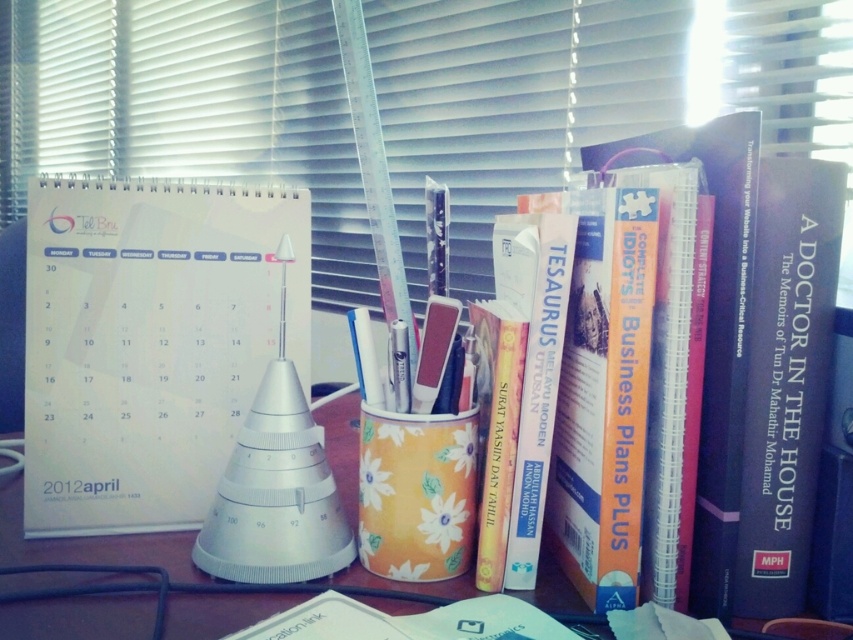
Does blue hardcover book at right appear over brown wooden table at center?

Yes, blue hardcover book at right is above brown wooden table at center.

Consider the image. Between blue hardcover book at right and brown wooden table at center, which one is positioned lower?

Positioned lower is brown wooden table at center.

You are a GUI agent. You are given a task and a screenshot of the screen. Output one action in this format:
    pyautogui.click(x=<x>, y=<y>)
    Task: Click on the blue hardcover book at right
    This screenshot has width=853, height=640.
    Given the screenshot: What is the action you would take?
    pyautogui.click(x=786, y=380)

Which is more to the right, hardcover book at center or brown wooden table at center?

From the viewer's perspective, hardcover book at center appears more on the right side.

Does point (764, 323) lie behind point (33, 636)?

Yes, it is behind point (33, 636).

Find the location of a particular element. This screenshot has height=640, width=853. hardcover book at center is located at coordinates (753, 353).

The width and height of the screenshot is (853, 640). Identify the location of hardcover book at center. (753, 353).

Between white plastic ruler at upper center and yellow floral-patterned cup at center, which one is positioned higher?

white plastic ruler at upper center is higher up.

Is point (503, 6) positioned behind point (392, 486)?

Yes.

Which is behind, point (332, 42) or point (364, 500)?

Point (332, 42)

Where is `white plastic ruler at upper center`? This screenshot has width=853, height=640. white plastic ruler at upper center is located at coordinates (199, 109).